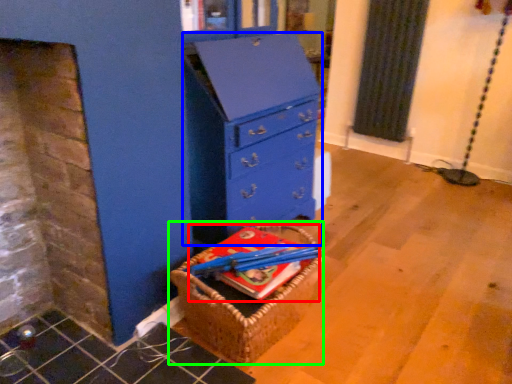
Question: Which is nearer to the book (highlighted by a red box)? chest of drawers (highlighted by a blue box) or basket (highlighted by a green box).

Choices:
 (A) chest of drawers
 (B) basket

Answer: (B)